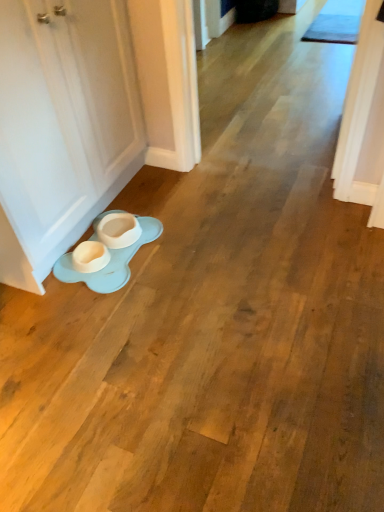
You are a GUI agent. You are given a task and a screenshot of the screen. Output one action in this format:
    pyautogui.click(x=<x>, y=<y>)
    Task: Click on the vacant area that is in front of light blue rubber saucer at lower left
    The width and height of the screenshot is (384, 512).
    Given the screenshot: What is the action you would take?
    pyautogui.click(x=109, y=315)